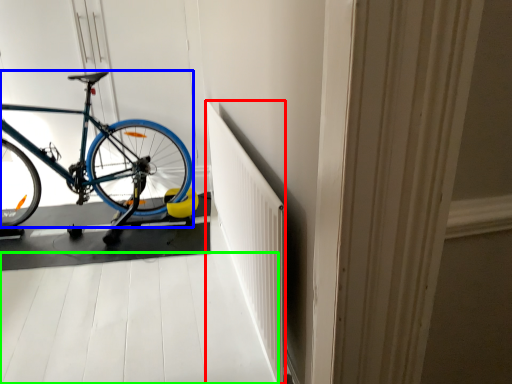
Question: Which object is positioned farthest from radiator (highlighted by a red box)? Select from bicycle (highlighted by a blue box) and path (highlighted by a green box).

Choices:
 (A) bicycle
 (B) path

Answer: (A)